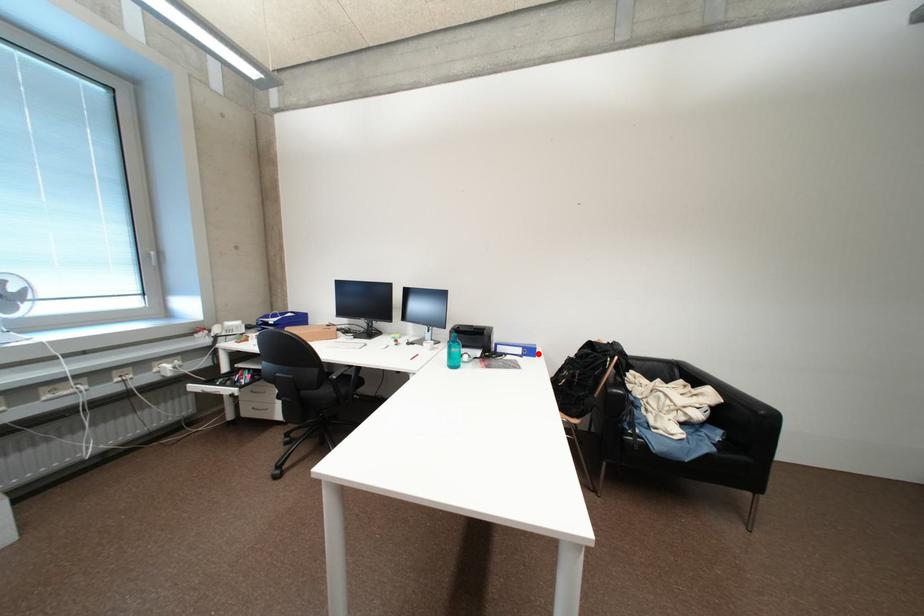
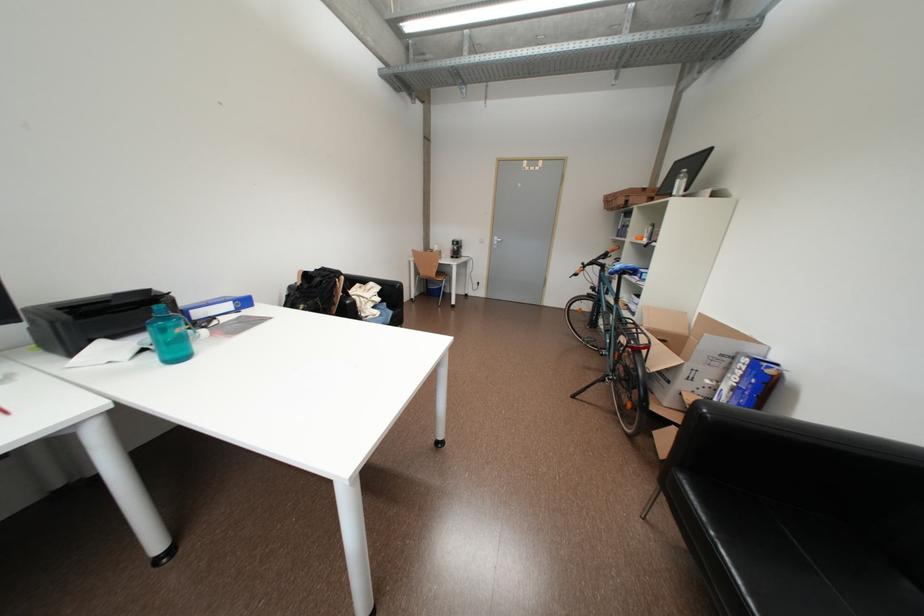
The point at the highlighted location is marked in the first image. Where is the corresponding point in the second image?

(252, 304)